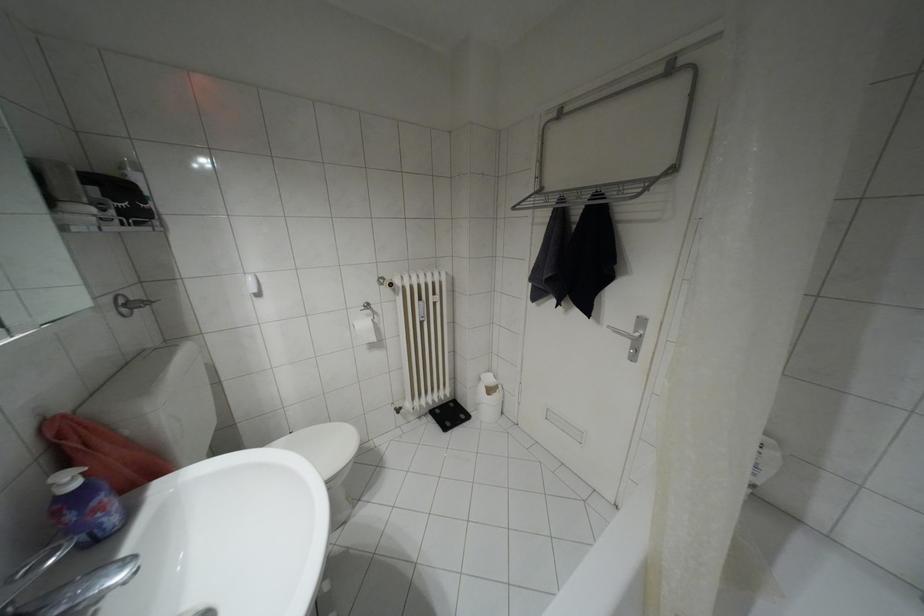
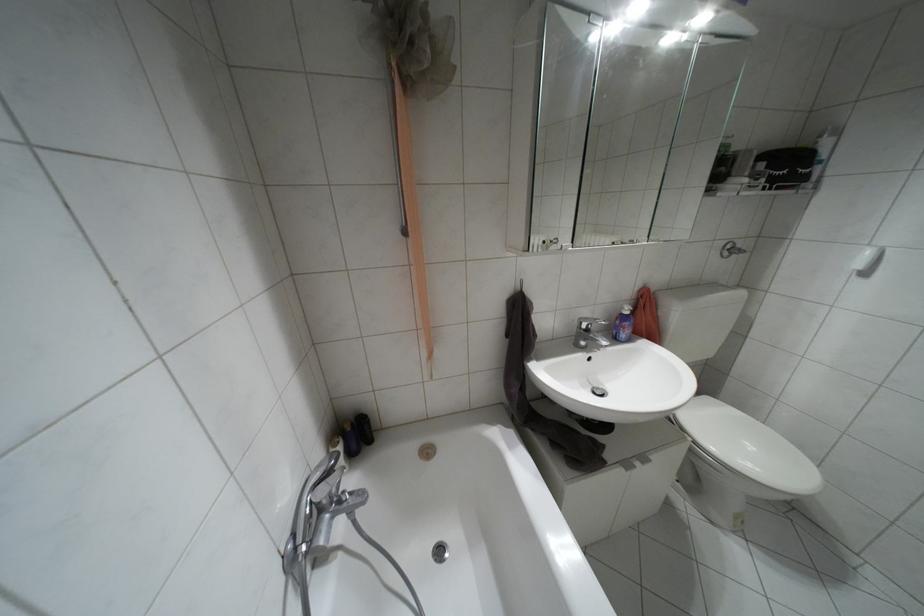
The point at [75,484] is marked in the first image. Where is the corresponding point in the second image?

(626, 312)